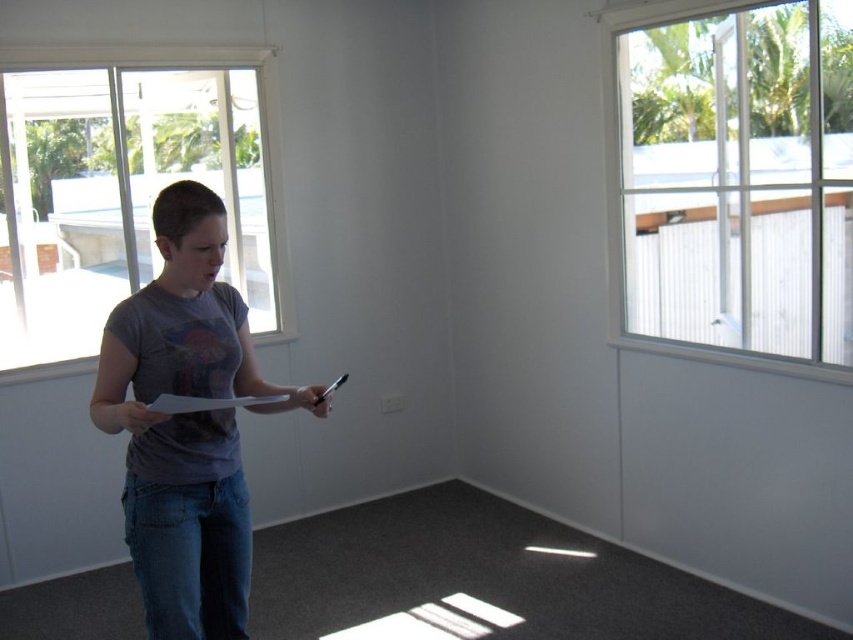
Who is more forward, (625, 108) or (119, 225)?

Point (625, 108)

Image resolution: width=853 pixels, height=640 pixels. What do you see at coordinates (728, 186) in the screenshot?
I see `clear glass window at upper right` at bounding box center [728, 186].

This screenshot has width=853, height=640. In order to click on clear glass window at upper right in this screenshot , I will do `click(728, 186)`.

Locate an element on the screen. clear glass window at upper right is located at coordinates (728, 186).

Is clear glass window at upper right positioned at the back of white paper clipboard at center?

Yes.

The width and height of the screenshot is (853, 640). What do you see at coordinates (728, 186) in the screenshot?
I see `clear glass window at upper right` at bounding box center [728, 186].

At what (x,y) coordinates should I click in order to perform the action: click on clear glass window at upper right. Please return your answer as a coordinate pair (x, y). This screenshot has height=640, width=853. Looking at the image, I should click on (728, 186).

Can you confirm if clear glass window at upper right is taller than gray t-shirt at center?

Indeed, clear glass window at upper right has a greater height compared to gray t-shirt at center.

Which is more to the left, clear glass window at upper right or gray t-shirt at center?

gray t-shirt at center is more to the left.

Locate an element on the screen. clear glass window at upper right is located at coordinates (728, 186).